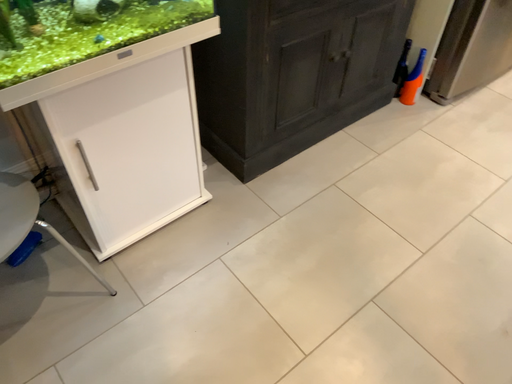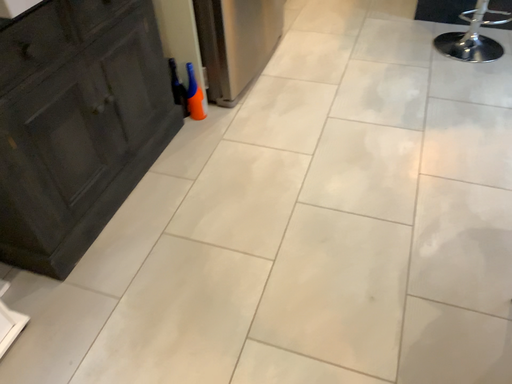
Question: How did the camera likely rotate when shooting the video?

Choices:
 (A) rotated downward
 (B) rotated upward

Answer: (B)